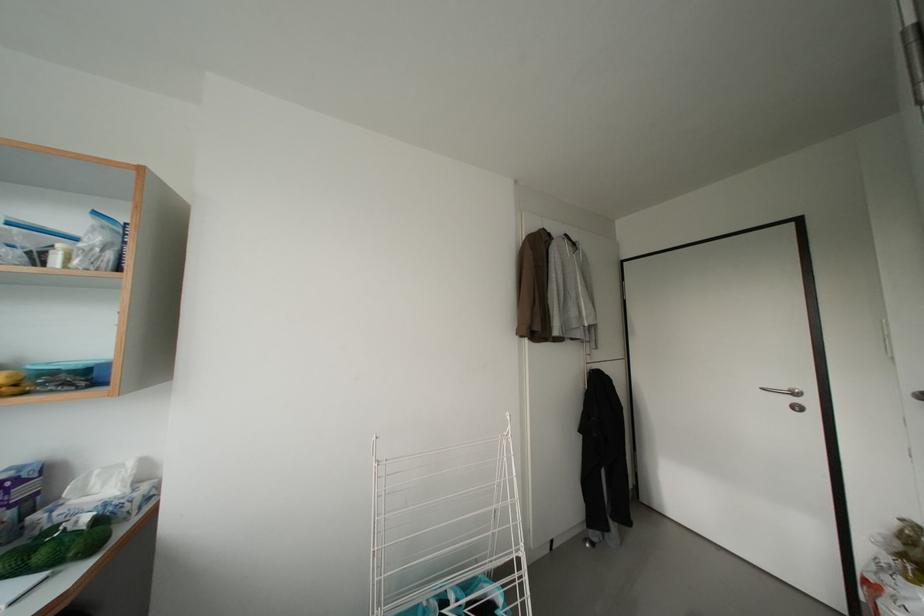
At what (x,y) coordinates should I click in order to perform the action: click on blue tissue box. Please return your answer as a coordinate pair (x, y). The width and height of the screenshot is (924, 616). Looking at the image, I should click on (18, 496).